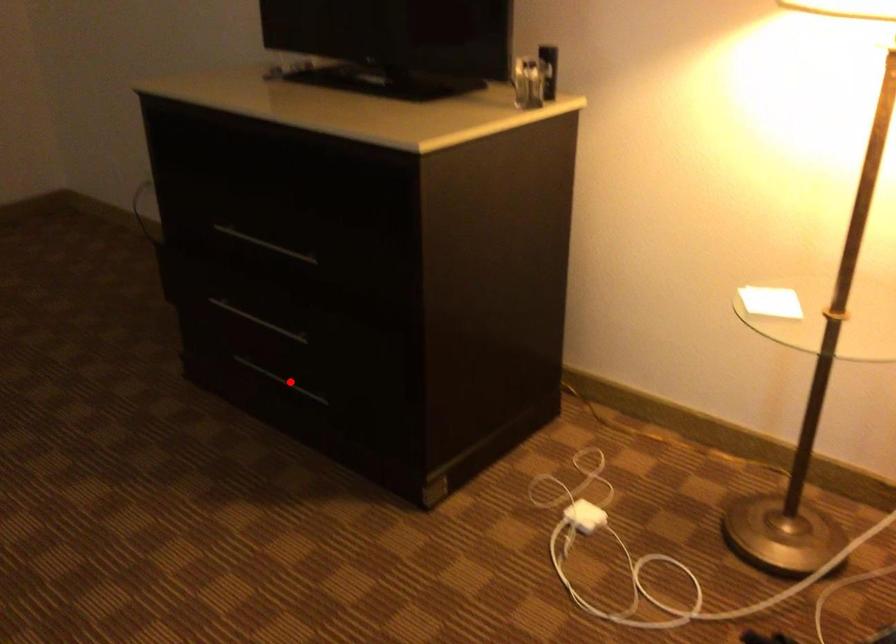
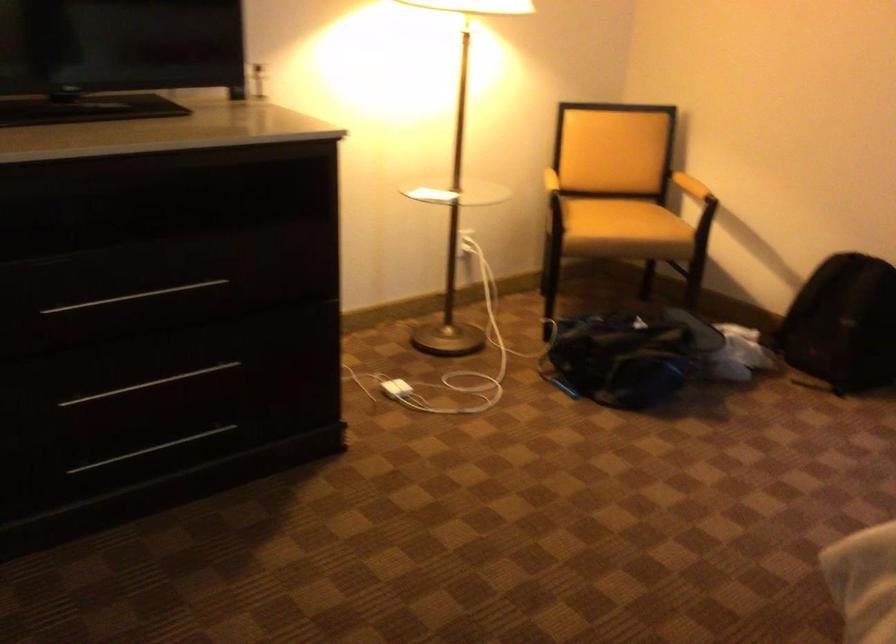
Locate, in the second image, the point that corresponds to the highlighted location in the first image.

(151, 449)